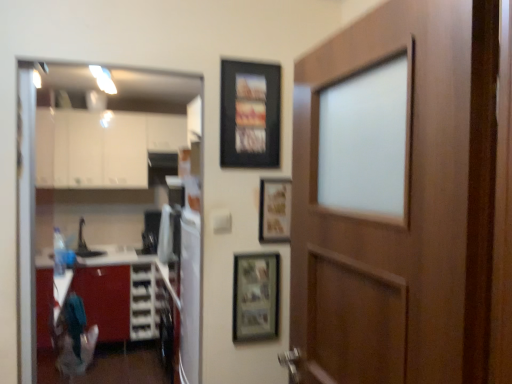
The image size is (512, 384). What do you see at coordinates (275, 210) in the screenshot?
I see `wooden picture frame at center, the 2th picture frame in the top-to-bottom sequence` at bounding box center [275, 210].

Where is `white glossy refrigerator at center`? white glossy refrigerator at center is located at coordinates (169, 233).

The height and width of the screenshot is (384, 512). Identify the location of transparent glass door at left. (102, 217).

You are a GUI agent. You are given a task and a screenshot of the screen. Output one action in this format:
    pyautogui.click(x=<x>, y=<y>)
    Task: Click on the wooden picture frame at center, arranged as the 2th picture frame when ordered from the bottom
    This screenshot has width=512, height=384.
    Given the screenshot: What is the action you would take?
    pyautogui.click(x=275, y=210)

Can you confirm if black matte picture frame at upper center, which is counted as the 1th picture frame, starting from the top, is taller than brushed metal cabinet at lower left, which ranks as the second cabinetry in top-to-bottom order?

No, black matte picture frame at upper center, which is counted as the 1th picture frame, starting from the top, is not taller than brushed metal cabinet at lower left, which ranks as the second cabinetry in top-to-bottom order.

Considering the relative positions of black matte picture frame at upper center, which is counted as the 1th picture frame, starting from the top, and brushed metal cabinet at lower left, which ranks as the second cabinetry in top-to-bottom order, in the image provided, is black matte picture frame at upper center, which is counted as the 1th picture frame, starting from the top, behind brushed metal cabinet at lower left, which ranks as the second cabinetry in top-to-bottom order,?

No, the depth of black matte picture frame at upper center, which is counted as the 1th picture frame, starting from the top, is less than that of brushed metal cabinet at lower left, which ranks as the second cabinetry in top-to-bottom order.

Would you consider black matte picture frame at upper center, the third picture frame from the bottom, to be distant from brushed metal cabinet at lower left, which ranks as the second cabinetry in top-to-bottom order?

Yes.

Find the location of `the 2nd picture frame located above the wooden-framed photo at center, marked as the first picture frame in a bottom-to-top arrangement (from a real-world perspective)`. the 2nd picture frame located above the wooden-framed photo at center, marked as the first picture frame in a bottom-to-top arrangement (from a real-world perspective) is located at coordinates (250, 114).

Considering the sizes of objects wooden-framed photo at center, the third picture frame viewed from the top, and black matte picture frame at upper center, the third picture frame from the bottom, in the image provided, who is shorter, wooden-framed photo at center, the third picture frame viewed from the top, or black matte picture frame at upper center, the third picture frame from the bottom,?

With less height is wooden-framed photo at center, the third picture frame viewed from the top.

How far apart are wooden-framed photo at center, marked as the first picture frame in a bottom-to-top arrangement, and black matte picture frame at upper center, which is counted as the 1th picture frame, starting from the top?

wooden-framed photo at center, marked as the first picture frame in a bottom-to-top arrangement, is 23.20 inches from black matte picture frame at upper center, which is counted as the 1th picture frame, starting from the top.

Is wooden-framed photo at center, marked as the first picture frame in a bottom-to-top arrangement, wider than black matte picture frame at upper center, the third picture frame from the bottom?

No, wooden-framed photo at center, marked as the first picture frame in a bottom-to-top arrangement, is not wider than black matte picture frame at upper center, the third picture frame from the bottom.

Which is behind, white glossy refrigerator at center or wooden door at right?

white glossy refrigerator at center is further away from the camera.

Is point (164, 243) positioned before point (497, 22)?

No, it is not.

Can you tell me how much white glossy refrigerator at center and wooden door at right differ in facing direction?

white glossy refrigerator at center and wooden door at right are facing 2.29 degrees away from each other.

Which is correct: white glossy refrigerator at center is inside wooden door at right, or outside of it?

white glossy refrigerator at center lies outside wooden door at right.

Who is shorter, white glossy refrigerator at center or wooden picture frame at center, arranged as the 2th picture frame when ordered from the bottom?

With less height is wooden picture frame at center, arranged as the 2th picture frame when ordered from the bottom.

Is white glossy refrigerator at center situated inside wooden picture frame at center, the 2th picture frame in the top-to-bottom sequence, or outside?

white glossy refrigerator at center is not enclosed by wooden picture frame at center, the 2th picture frame in the top-to-bottom sequence.

Between white glossy refrigerator at center and wooden picture frame at center, arranged as the 2th picture frame when ordered from the bottom, which one has larger size?

white glossy refrigerator at center.

Considering the points (308, 241) and (164, 243), which point is in front, point (308, 241) or point (164, 243)?

Point (308, 241)

Which object is positioned more to the left, wooden door at right or white glossy refrigerator at center?

white glossy refrigerator at center is more to the left.

From a real-world perspective, which is physically above, wooden door at right or white glossy refrigerator at center?

wooden door at right, from a real-world perspective.

Based on their positions, is brushed metal cabinet at lower left, which ranks as the second cabinetry in top-to-bottom order, located to the left or right of wooden door at right?

Clearly, brushed metal cabinet at lower left, which ranks as the second cabinetry in top-to-bottom order, is on the left of wooden door at right in the image.

Which object is further away from the camera taking this photo, brushed metal cabinet at lower left, acting as the 1th cabinetry starting from the bottom, or wooden door at right?

Positioned behind is brushed metal cabinet at lower left, acting as the 1th cabinetry starting from the bottom.

From the picture: How much distance is there between brushed metal cabinet at lower left, which ranks as the second cabinetry in top-to-bottom order, and wooden door at right?

They are 2.67 meters apart.

From the image's perspective, which is above, brushed metal cabinet at lower left, which ranks as the second cabinetry in top-to-bottom order, or wooden door at right?

wooden door at right, from the image's perspective.

Could you tell me if black matte picture frame at upper center, which is counted as the 1th picture frame, starting from the top, is facing white glossy refrigerator at center?

No, black matte picture frame at upper center, which is counted as the 1th picture frame, starting from the top, is not turned towards white glossy refrigerator at center.

Is black matte picture frame at upper center, the third picture frame from the bottom, not within white glossy refrigerator at center?

Yes.

Which of these two, black matte picture frame at upper center, which is counted as the 1th picture frame, starting from the top, or white glossy refrigerator at center, is wider?

white glossy refrigerator at center.

Locate an element on the screen. This screenshot has width=512, height=384. the 2nd cabinetry positioned below the black matte picture frame at upper center, the third picture frame from the bottom (from a real-world perspective) is located at coordinates (123, 293).

From the black matte picture frame at upper center, the third picture frame from the bottom, count 1st picture frame to the right and point to it. Please provide its 2D coordinates.

[(256, 297)]

Consider the image. From the image, which object appears to be nearer to wooden door at right, wooden-framed photo at center, the third picture frame viewed from the top, or white glossy refrigerator at center?

wooden-framed photo at center, the third picture frame viewed from the top, is positioned closer to the anchor wooden door at right.

Based on their spatial positions, is wooden-framed photo at center, the third picture frame viewed from the top, or brushed metal cabinet at lower left, which ranks as the second cabinetry in top-to-bottom order, further from wooden picture frame at center, the 2th picture frame in the top-to-bottom sequence?

The object further to wooden picture frame at center, the 2th picture frame in the top-to-bottom sequence, is brushed metal cabinet at lower left, which ranks as the second cabinetry in top-to-bottom order.

Based on their spatial positions, is transparent glass door at left or wooden-framed photo at center, marked as the first picture frame in a bottom-to-top arrangement, closer to black matte picture frame at upper center, which is counted as the 1th picture frame, starting from the top?

wooden-framed photo at center, marked as the first picture frame in a bottom-to-top arrangement, lies closer to black matte picture frame at upper center, which is counted as the 1th picture frame, starting from the top, than the other object.

Considering their positions, is brushed metal cabinet at lower left, acting as the 1th cabinetry starting from the bottom, positioned closer to wooden door at right than wooden picture frame at center, arranged as the 2th picture frame when ordered from the bottom?

wooden picture frame at center, arranged as the 2th picture frame when ordered from the bottom, is positioned closer to the anchor wooden door at right.

When comparing their distances from black matte picture frame at upper center, which is counted as the 1th picture frame, starting from the top, does wooden door at right or white glossy refrigerator at center seem further?

The object further to black matte picture frame at upper center, which is counted as the 1th picture frame, starting from the top, is white glossy refrigerator at center.

Considering their positions, is white glossy cabinets at upper left, the first cabinetry positioned from the top, positioned further to transparent glass door at left than wooden-framed photo at center, the third picture frame viewed from the top?

The object further to transparent glass door at left is wooden-framed photo at center, the third picture frame viewed from the top.

Estimate the real-world distances between objects in this image. Which object is further from white glossy cabinets at upper left, the first cabinetry positioned from the top, wooden picture frame at center, arranged as the 2th picture frame when ordered from the bottom, or wooden door at right?

wooden door at right is further to white glossy cabinets at upper left, the first cabinetry positioned from the top.

In the scene shown: Considering their positions, is white glossy cabinets at upper left, the first cabinetry positioned from the top, positioned closer to wooden-framed photo at center, marked as the first picture frame in a bottom-to-top arrangement, than wooden picture frame at center, arranged as the 2th picture frame when ordered from the bottom?

Based on the image, wooden picture frame at center, arranged as the 2th picture frame when ordered from the bottom, appears to be nearer to wooden-framed photo at center, marked as the first picture frame in a bottom-to-top arrangement.

This screenshot has width=512, height=384. I want to click on glass door between wooden door at right and black matte picture frame at upper center, the third picture frame from the bottom, from front to back, so pos(102,217).

At what (x,y) coordinates should I click in order to perform the action: click on cabinetry located between wooden picture frame at center, arranged as the 2th picture frame when ordered from the bottom, and white glossy cabinets at upper left, acting as the second cabinetry starting from the bottom, in the depth direction. Please return your answer as a coordinate pair (x, y). The width and height of the screenshot is (512, 384). Looking at the image, I should click on (123, 293).

At what (x,y) coordinates should I click in order to perform the action: click on cabinetry located between wooden-framed photo at center, marked as the first picture frame in a bottom-to-top arrangement, and white glossy cabinets at upper left, the first cabinetry positioned from the top, in the depth direction. Please return your answer as a coordinate pair (x, y). Looking at the image, I should click on (123, 293).

Where is `appliance between black matte picture frame at upper center, the third picture frame from the bottom, and brushed metal cabinet at lower left, acting as the 1th cabinetry starting from the bottom, in the front-back direction`? This screenshot has height=384, width=512. appliance between black matte picture frame at upper center, the third picture frame from the bottom, and brushed metal cabinet at lower left, acting as the 1th cabinetry starting from the bottom, in the front-back direction is located at coordinates (169, 233).